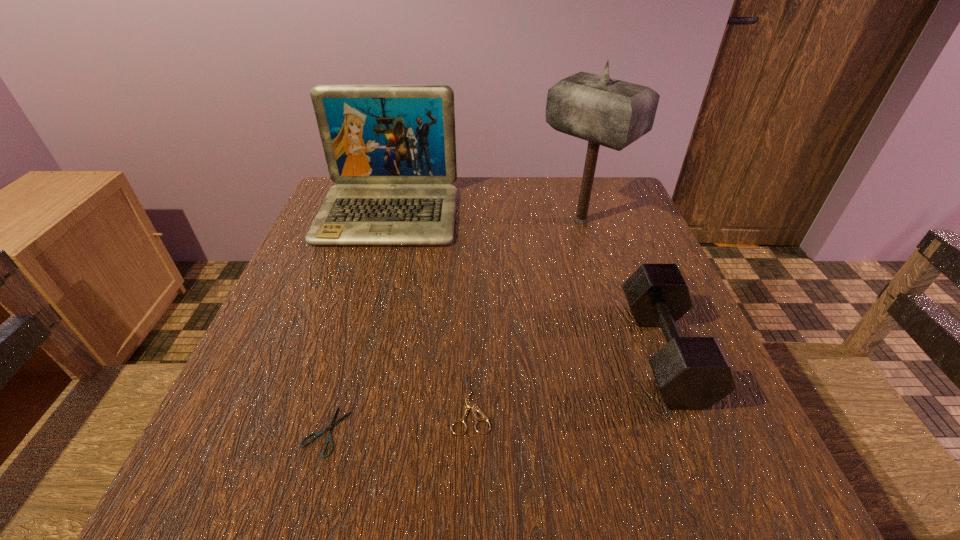
The width and height of the screenshot is (960, 540). Find the location of `object that is at the near left corner`. object that is at the near left corner is located at coordinates (330, 428).

Where is `object that is positioned at the far right corner`? object that is positioned at the far right corner is located at coordinates (604, 111).

Locate an element on the screen. The height and width of the screenshot is (540, 960). vacant space at the far edge of the desktop is located at coordinates (492, 182).

Where is `free region at the left edge of the desktop`? The image size is (960, 540). free region at the left edge of the desktop is located at coordinates (305, 386).

Image resolution: width=960 pixels, height=540 pixels. In the image, there is a desktop. Identify the location of vacant space at the right edge. (602, 271).

Identify the location of vacant space at the far right corner. The height and width of the screenshot is (540, 960). (578, 188).

This screenshot has width=960, height=540. In order to click on free space between the shortest object and the tallest object in this screenshot , I will do `click(453, 326)`.

Locate an element on the screen. The image size is (960, 540). vacant area that lies between the mallet and the laptop computer is located at coordinates (485, 218).

You are a GUI agent. You are given a task and a screenshot of the screen. Output one action in this format:
    pyautogui.click(x=<x>, y=<y>)
    Task: Click on the free space between the mallet and the fourth shortest object
    
    Given the screenshot: What is the action you would take?
    pyautogui.click(x=485, y=218)

Find the location of a particular element. free area in between the shortest object and the dumbbell is located at coordinates (494, 392).